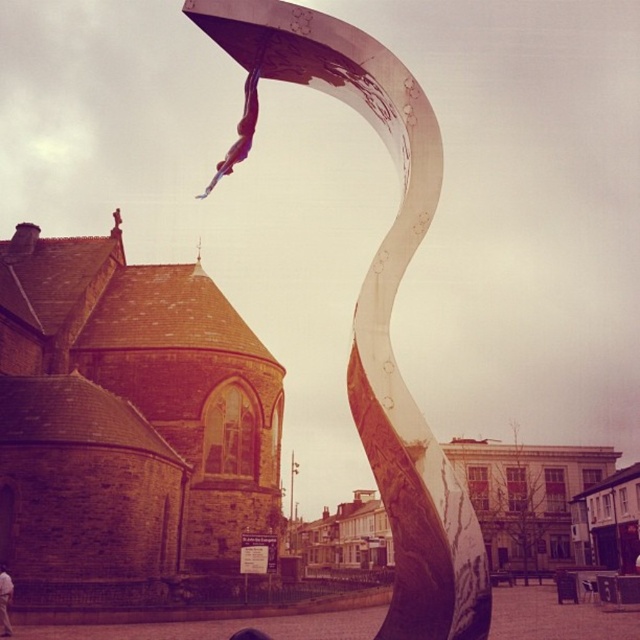
You are standing at a point 25.88 meters away from the point marked at coordinates (381, 349) in the image. If you want to move closer to that point, which direction should you walk relative to the sculpture?

Since the point marked at coordinates (381, 349) is 25.88 meters away from you, you should walk towards the sculpture to get closer to that point.

You are a photographer standing in the park where the metallic polished sculpture at center and the white cotton shirt at lower left are located. You want to capture a photo that includes both objects in the frame. Which object should you focus on first to ensure both are in the shot?

The metallic polished sculpture at center is taller than the white cotton shirt at lower left, so focusing on the sculpture first will help ensure both objects are included in the frame.

You are a photographer standing at a certain distance from the metallic polished sculpture at center. You want to capture a full view of the sculpture in your shot without any cropping. What is the minimum distance you should stand from the sculpture to ensure it fits entirely in your camera frame?

The metallic polished sculpture at center is 73.56 feet away from the camera. To capture the full view without cropping, the photographer should stand at least 73.56 feet away from the sculpture to ensure it fits entirely in the frame.